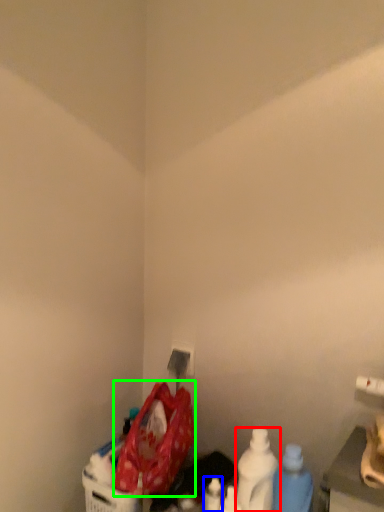
Question: Considering the real-world distances, which object is closest to bottle (highlighted by a red box)? bottle (highlighted by a blue box) or waste (highlighted by a green box).

Choices:
 (A) bottle
 (B) waste

Answer: (A)